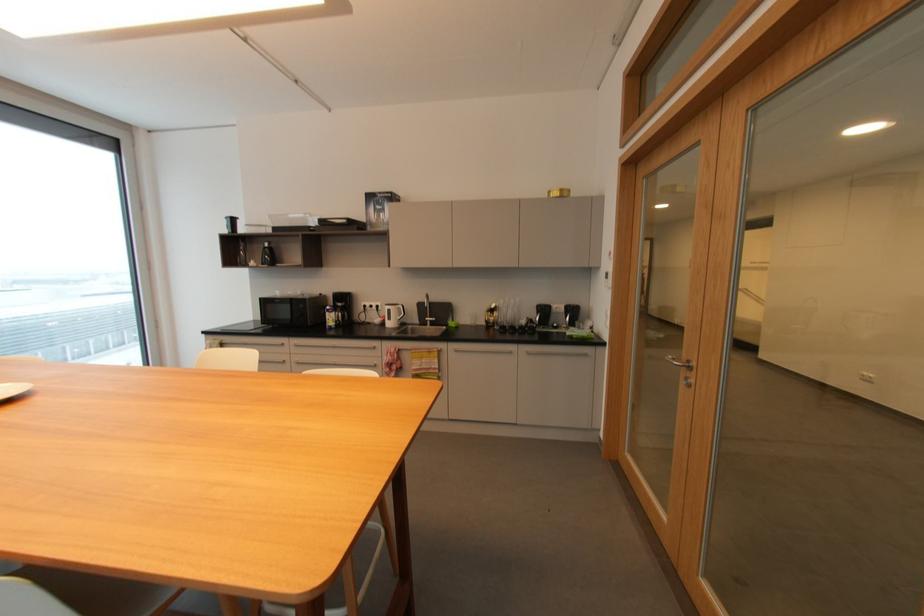
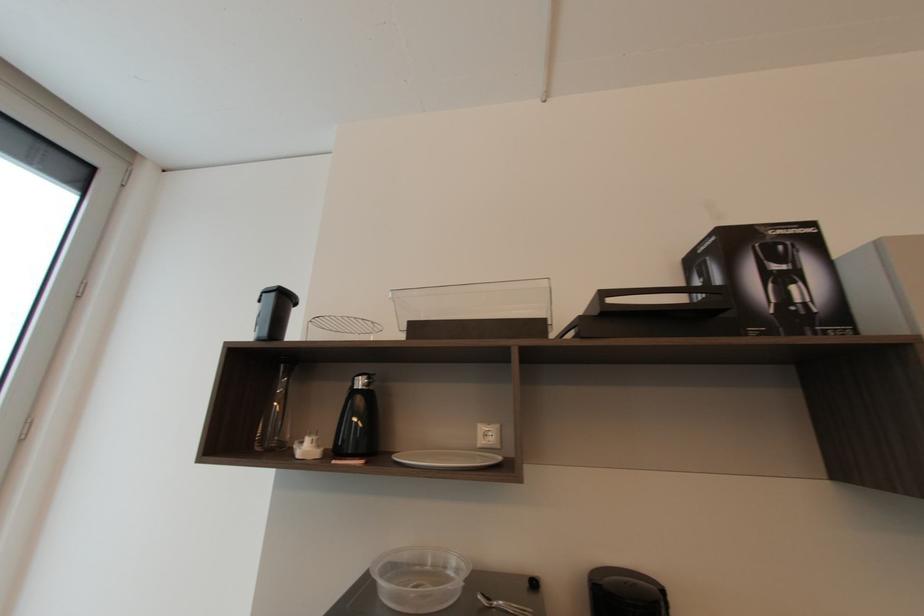
Where in the second image is the point corresponding to point 271,245 from the first image?

(362, 384)